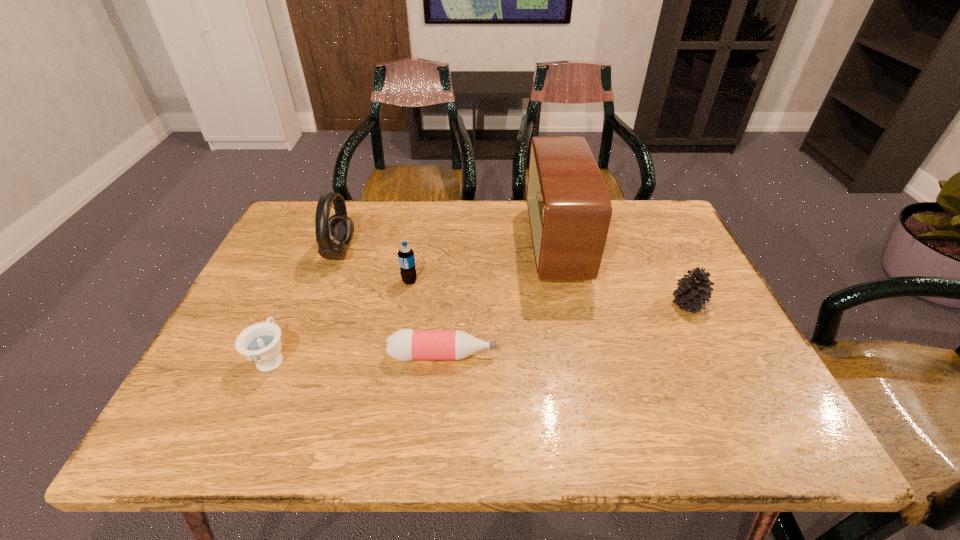
What are the coordinates of `vacant space at the far right corner of the desktop` in the screenshot? It's located at (640, 236).

This screenshot has width=960, height=540. Find the location of `vacant area that lies between the teacup and the shortest object`. vacant area that lies between the teacup and the shortest object is located at coordinates (357, 356).

You are a GUI agent. You are given a task and a screenshot of the screen. Output one action in this format:
    pyautogui.click(x=<x>, y=<y>)
    Task: Click on the empty space that is in between the pinecone and the soda bottle
    The image size is (960, 540).
    Given the screenshot: What is the action you would take?
    pyautogui.click(x=549, y=292)

Where is `blank region between the soda bottle and the teacup`? blank region between the soda bottle and the teacup is located at coordinates (341, 319).

You are a GUI agent. You are given a task and a screenshot of the screen. Output one action in this format:
    pyautogui.click(x=<x>, y=<y>)
    Task: Click on the vacant area that lies between the second tallest object and the soda bottle
    The image size is (960, 540).
    Given the screenshot: What is the action you would take?
    pyautogui.click(x=374, y=266)

Locate an element on the screen. The image size is (960, 540). free space between the rightmost object and the soda bottle is located at coordinates pos(549,292).

The image size is (960, 540). I want to click on free space between the soda bottle and the radio receiver, so click(x=483, y=262).

Image resolution: width=960 pixels, height=540 pixels. Identify the location of vacant region between the soda bottle and the pinecone. (549, 292).

Where is `vacant space that's between the second tallest object and the pinecone`? The image size is (960, 540). vacant space that's between the second tallest object and the pinecone is located at coordinates (514, 278).

You are a GUI agent. You are given a task and a screenshot of the screen. Output one action in this format:
    pyautogui.click(x=<x>, y=<y>)
    Task: Click on the vacant region between the pinecone and the tallest object
    
    Given the screenshot: What is the action you would take?
    pyautogui.click(x=622, y=274)